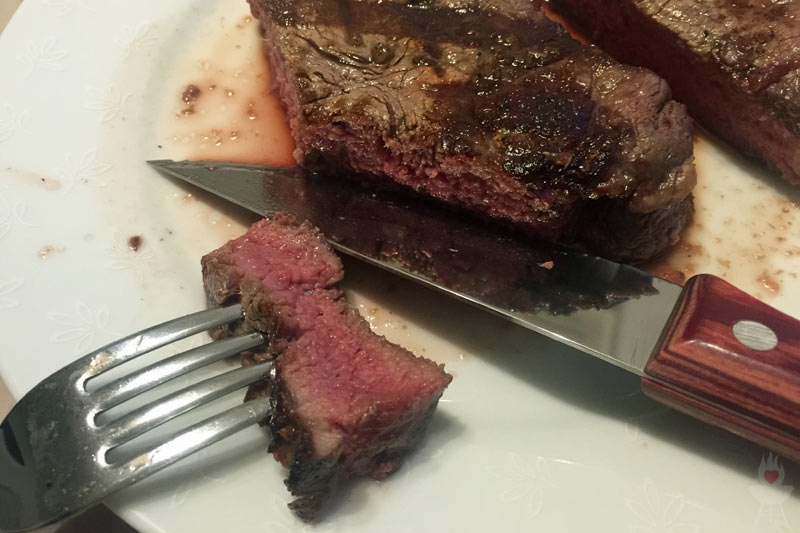
At what (x,y) coordinates should I click in order to perform the action: click on table. Please return your answer as a coordinate pair (x, y). Looking at the image, I should click on (4, 10).